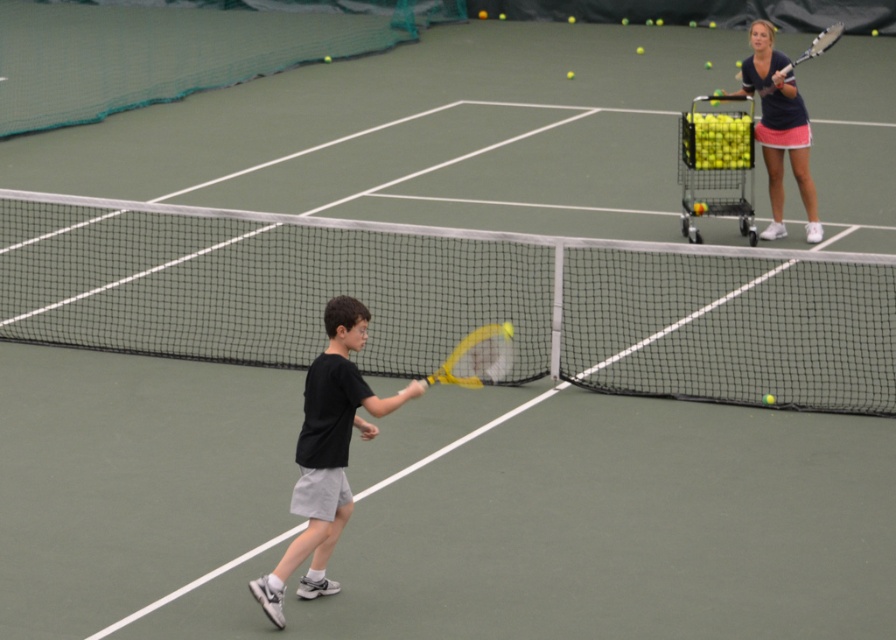
Who is more distant from viewer, (735, 168) or (797, 58)?

Point (797, 58)

Is point (750, 131) positioned before point (813, 42)?

That is True.

The image size is (896, 640). I want to click on metallic yellow shopping cart at upper right, so click(x=714, y=164).

Who is lower down, metallic yellow shopping cart at upper right or yellow matte tennis racket at center?

yellow matte tennis racket at center is lower down.

You are a GUI agent. You are given a task and a screenshot of the screen. Output one action in this format:
    pyautogui.click(x=<x>, y=<y>)
    Task: Click on the metallic yellow shopping cart at upper right
    The image size is (896, 640).
    Given the screenshot: What is the action you would take?
    pyautogui.click(x=714, y=164)

Does point (703, 154) come closer to viewer compared to point (463, 372)?

No, it is behind (463, 372).

Locate an element on the screen. Image resolution: width=896 pixels, height=640 pixels. metallic yellow shopping cart at upper right is located at coordinates (714, 164).

Does point (760, 99) lie in front of point (826, 42)?

No, it is not.

Which is more to the left, matte blue tennis racket at upper right or yellow matte tennis racket at upper right?

Positioned to the left is matte blue tennis racket at upper right.

Find the location of `matte blue tennis racket at upper right`. matte blue tennis racket at upper right is located at coordinates click(780, 129).